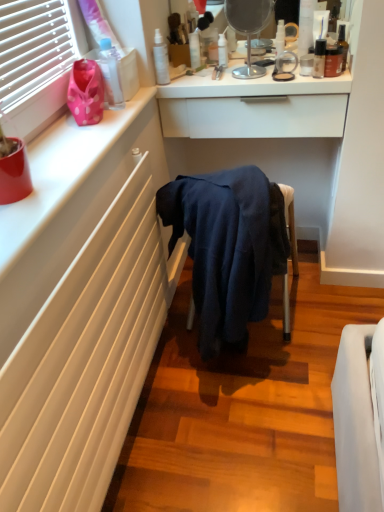
Identify the location of satin white spray bottle at upper center, the 2th toiletry from the left. (161, 59).

What do you see at coordinates (248, 29) in the screenshot?
I see `metallic silver mirror at upper center` at bounding box center [248, 29].

Describe the element at coordinates (319, 58) in the screenshot. This screenshot has height=512, width=384. I see `satin black bottle at upper right, the 3th toiletry from the right` at that location.

Describe the element at coordinates (290, 222) in the screenshot. The width and height of the screenshot is (384, 512). I see `dark blue fabric at center` at that location.

What do you see at coordinates (333, 61) in the screenshot? The width and height of the screenshot is (384, 512). I see `matte brown bottle at upper right, the 2th toiletry positioned from the right` at bounding box center [333, 61].

Identify the location of white glossy bottle at upper center, the fourth toiletry when ordered from right to left. (280, 37).

Where is `white matte counter top at upper left`? The image size is (384, 512). white matte counter top at upper left is located at coordinates (60, 173).

Find the location of a particular element. This screenshot has height=512, width=384. satin white spray bottle at upper center, marked as the seventh toiletry in a right-to-left arrangement is located at coordinates click(161, 59).

Which object is positioned more to the right, translucent plastic spray bottle at upper center, arranged as the fourth toiletry when viewed from the left, or matte brown bottle at upper right, the 2th toiletry positioned from the right?

Positioned to the right is matte brown bottle at upper right, the 2th toiletry positioned from the right.

Between translucent plastic spray bottle at upper center, marked as the fifth toiletry in a right-to-left arrangement, and matte brown bottle at upper right, the 2th toiletry positioned from the right, which one is positioned in front?

matte brown bottle at upper right, the 2th toiletry positioned from the right, is more forward.

From a real-world perspective, which object rests below the other?

matte brown bottle at upper right, the 2th toiletry positioned from the right.

Find the location of a particular element. The width and height of the screenshot is (384, 512). the 3rd toiletry above the matte brown bottle at upper right, the 2th toiletry positioned from the right (from the image's perspective) is located at coordinates (222, 51).

Find the location of a particular element. Image resolution: width=384 pixels, height=512 pixels. toiletry that is the 3rd object directly below the satin white spray bottle at upper center, marked as the seventh toiletry in a right-to-left arrangement (from a real-world perspective) is located at coordinates (194, 49).

Between transparent plastic bottle at upper center, which ranks as the sixth toiletry in right-to-left order, and satin white spray bottle at upper center, marked as the seventh toiletry in a right-to-left arrangement, which one has larger size?

With larger size is satin white spray bottle at upper center, marked as the seventh toiletry in a right-to-left arrangement.

From the image's perspective, which one is positioned lower, transparent plastic bottle at upper center, arranged as the third toiletry when viewed from the left, or satin white spray bottle at upper center, the 2th toiletry from the left?

satin white spray bottle at upper center, the 2th toiletry from the left, appears lower in the image.

How many degrees apart are the facing directions of transparent plastic bottle at upper center, which ranks as the sixth toiletry in right-to-left order, and satin white spray bottle at upper center, marked as the seventh toiletry in a right-to-left arrangement?

0.00509 degrees separate the facing orientations of transparent plastic bottle at upper center, which ranks as the sixth toiletry in right-to-left order, and satin white spray bottle at upper center, marked as the seventh toiletry in a right-to-left arrangement.

Does white matte counter top at upper left have a larger size compared to white glossy bottle at upper center, which is counted as the fifth toiletry, starting from the left?

Indeed, white matte counter top at upper left has a larger size compared to white glossy bottle at upper center, which is counted as the fifth toiletry, starting from the left.

Is white matte counter top at upper left located outside white glossy bottle at upper center, which is counted as the fifth toiletry, starting from the left?

white matte counter top at upper left is positioned outside white glossy bottle at upper center, which is counted as the fifth toiletry, starting from the left.

The height and width of the screenshot is (512, 384). I want to click on counter top below the white glossy bottle at upper center, which is counted as the fifth toiletry, starting from the left (from a real-world perspective), so click(60, 173).

Does metallic silver mirror at upper center have a lesser width compared to white glossy bottle at upper center, the fourth toiletry when ordered from right to left?

No, metallic silver mirror at upper center is not thinner than white glossy bottle at upper center, the fourth toiletry when ordered from right to left.

Is metallic silver mirror at upper center closer to camera compared to white glossy bottle at upper center, the fourth toiletry when ordered from right to left?

That is True.

From a real-world perspective, relative to white glossy bottle at upper center, the fourth toiletry when ordered from right to left, is metallic silver mirror at upper center vertically above or below?

From a real-world perspective, metallic silver mirror at upper center is physically above white glossy bottle at upper center, the fourth toiletry when ordered from right to left.

From the picture: Does white matte radiator at lower left turn towards white glossy drawer at upper center?

No, white matte radiator at lower left is not aimed at white glossy drawer at upper center.

Considering the relative sizes of white matte radiator at lower left and white glossy drawer at upper center in the image provided, is white matte radiator at lower left shorter than white glossy drawer at upper center?

No, white matte radiator at lower left is not shorter than white glossy drawer at upper center.

Is white matte radiator at lower left spatially inside white glossy drawer at upper center, or outside of it?

white matte radiator at lower left lies outside white glossy drawer at upper center.

Looking at this image, measure the distance between white matte radiator at lower left and white glossy drawer at upper center.

23.13 inches.

From a real-world perspective, between metallic silver mirror at upper center and white matte radiator at lower left, who is vertically higher?

From a 3D spatial view, metallic silver mirror at upper center is above.

Is metallic silver mirror at upper center oriented away from white matte radiator at lower left?

metallic silver mirror at upper center is not turned away from white matte radiator at lower left.

Considering the relative positions of metallic silver mirror at upper center and white matte radiator at lower left in the image provided, is metallic silver mirror at upper center to the right of white matte radiator at lower left from the viewer's perspective?

Correct, you'll find metallic silver mirror at upper center to the right of white matte radiator at lower left.

From the image's perspective, between metallic silver mirror at upper center and white matte radiator at lower left, who is located below?

white matte radiator at lower left appears lower in the image.

From a real-world perspective, is satin white spray bottle at upper center, the 2th toiletry from the left, physically below satin black bottle at upper right, the 3th toiletry from the right?

Actually, satin white spray bottle at upper center, the 2th toiletry from the left, is physically above satin black bottle at upper right, the 3th toiletry from the right, in the real world.

From the image's perspective, relative to satin black bottle at upper right, the 3th toiletry from the right, is satin white spray bottle at upper center, the 2th toiletry from the left, above or below?

From the image's perspective, satin white spray bottle at upper center, the 2th toiletry from the left, appears above satin black bottle at upper right, the 3th toiletry from the right.

Considering the sizes of objects satin white spray bottle at upper center, the 2th toiletry from the left, and satin black bottle at upper right, placed as the sixth toiletry when sorted from left to right, in the image provided, who is taller, satin white spray bottle at upper center, the 2th toiletry from the left, or satin black bottle at upper right, placed as the sixth toiletry when sorted from left to right,?

Standing taller between the two is satin white spray bottle at upper center, the 2th toiletry from the left.

Identify the location of the 2nd toiletry below when counting from the satin white spray bottle at upper center, the 2th toiletry from the left (from the image's perspective). click(x=319, y=58).

This screenshot has width=384, height=512. What are the coordinates of `toiletry that is the 3rd one when counting leftward from the matte brown bottle at upper right, the seventh toiletry in the left-to-right sequence` in the screenshot? It's located at (222, 51).

You are a GUI agent. You are given a task and a screenshot of the screen. Output one action in this format:
    pyautogui.click(x=<x>, y=<y>)
    Task: Click on the 1st toiletry to the right of the satin white spray bottle at upper center, marked as the seventh toiletry in a right-to-left arrangement, starting your count from the anchor
    
    Given the screenshot: What is the action you would take?
    pyautogui.click(x=194, y=49)

From the image, which object appears to be farther from white matte radiator at lower left, dark blue fabric at center or transparent plastic bottle at upper center, arranged as the third toiletry when viewed from the left?

transparent plastic bottle at upper center, arranged as the third toiletry when viewed from the left.

Looking at the image, which one is located closer to shiny brown bottle at upper right, the first toiletry positioned from the right, translucent plastic spray bottle at upper center, marked as the fifth toiletry in a right-to-left arrangement, or dark blue fabric at center?

translucent plastic spray bottle at upper center, marked as the fifth toiletry in a right-to-left arrangement, is closer to shiny brown bottle at upper right, the first toiletry positioned from the right.

When comparing their distances from matte brown bottle at upper right, the 2th toiletry positioned from the right, does dark blue fabric at center or white glossy bottle at upper center, the fourth toiletry when ordered from right to left, seem closer?

Among the two, white glossy bottle at upper center, the fourth toiletry when ordered from right to left, is located nearer to matte brown bottle at upper right, the 2th toiletry positioned from the right.

From the image, which object appears to be farther from white matte radiator at lower left, matte brown bottle at upper right, the seventh toiletry in the left-to-right sequence, or metallic silver mirror at upper center?

Based on the image, matte brown bottle at upper right, the seventh toiletry in the left-to-right sequence, appears to be further to white matte radiator at lower left.

Looking at the image, which one is located further to satin white spray bottle at upper center, the 2th toiletry from the left, white matte counter top at upper left or metallic silver mirror at upper center?

white matte counter top at upper left.

Looking at the image, which one is located closer to metallic silver mirror at upper center, transparent plastic bottle at upper center, which ranks as the sixth toiletry in right-to-left order, or white glossy bottle at upper center, which is counted as the fifth toiletry, starting from the left?

white glossy bottle at upper center, which is counted as the fifth toiletry, starting from the left.

Based on their spatial positions, is shiny brown bottle at upper right, the 8th toiletry viewed from the left, or satin white spray bottle at upper center, marked as the seventh toiletry in a right-to-left arrangement, further from dark blue fabric at center?

satin white spray bottle at upper center, marked as the seventh toiletry in a right-to-left arrangement, is positioned further to the anchor dark blue fabric at center.

Estimate the real-world distances between objects in this image. Which object is further from transparent plastic bottle at upper center, which ranks as the sixth toiletry in right-to-left order, white glossy drawer at upper center or translucent plastic spray bottle at upper center, marked as the fifth toiletry in a right-to-left arrangement?

white glossy drawer at upper center is positioned further to the anchor transparent plastic bottle at upper center, which ranks as the sixth toiletry in right-to-left order.

Identify the location of mirror that lies between white glossy bottle at upper center, which is counted as the fifth toiletry, starting from the left, and white matte radiator at lower left from top to bottom. Image resolution: width=384 pixels, height=512 pixels. (248, 29).

Find the location of a particular element. This screenshot has height=512, width=384. counter between transparent plastic bottle at upper center, arranged as the third toiletry when viewed from the left, and white glossy bottle at upper center, the fourth toiletry when ordered from right to left, from left to right is located at coordinates [x=254, y=106].

You are a GUI agent. You are given a task and a screenshot of the screen. Output one action in this format:
    pyautogui.click(x=<x>, y=<y>)
    Task: Click on the mirror between transparent plastic bottle at upper center, arranged as the third toiletry when viewed from the left, and white matte radiator at lower left vertically
    This screenshot has height=512, width=384.
    Given the screenshot: What is the action you would take?
    pyautogui.click(x=248, y=29)

Where is `counter between metallic silver mirror at upper center and white matte radiator at lower left from top to bottom`? counter between metallic silver mirror at upper center and white matte radiator at lower left from top to bottom is located at coordinates coord(254,106).